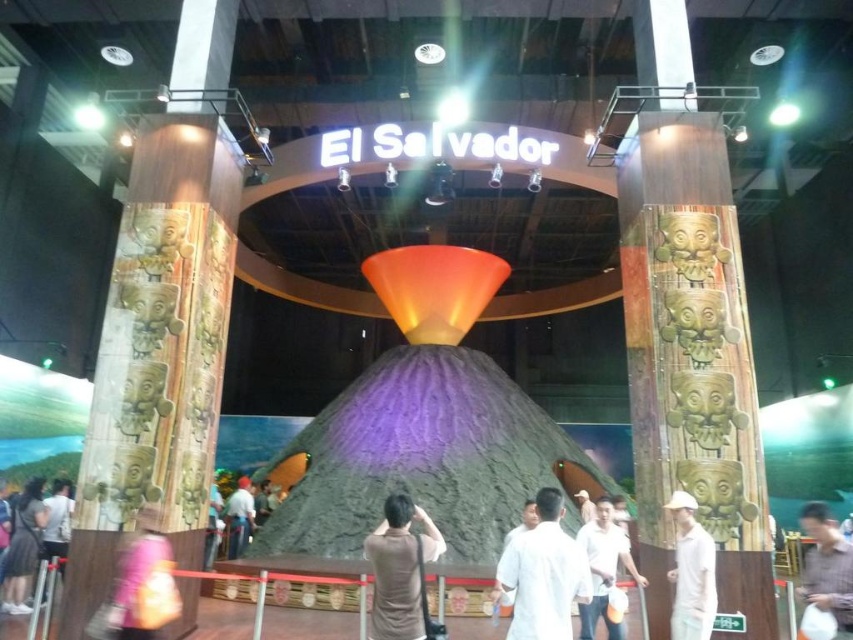
What do you see at coordinates (543, 573) in the screenshot? This screenshot has height=640, width=853. I see `white cotton shirt at center` at bounding box center [543, 573].

Is white cotton shirt at center below white shirt at center?

No.

Where is `white cotton shirt at center`? The image size is (853, 640). white cotton shirt at center is located at coordinates (543, 573).

This screenshot has width=853, height=640. I want to click on white cotton shirt at center, so click(543, 573).

Does white cotton shirt at center have a larger size compared to matte gray shirt at lower left?

No.

Is white cotton shirt at center further to camera compared to matte gray shirt at lower left?

No, white cotton shirt at center is closer to the viewer.

Find the location of `white cotton shirt at center`. white cotton shirt at center is located at coordinates (543, 573).

Locate an element on the screen. white cotton shirt at center is located at coordinates (543, 573).

Does brown matte shirt at center have a greater width compared to matte gray shirt at lower left?

No, brown matte shirt at center is not wider than matte gray shirt at lower left.

Is the position of brown matte shirt at center less distant than that of matte gray shirt at lower left?

Answer: Yes, it is in front of matte gray shirt at lower left.

This screenshot has height=640, width=853. What are the coordinates of `brown matte shirt at center` in the screenshot? It's located at (399, 570).